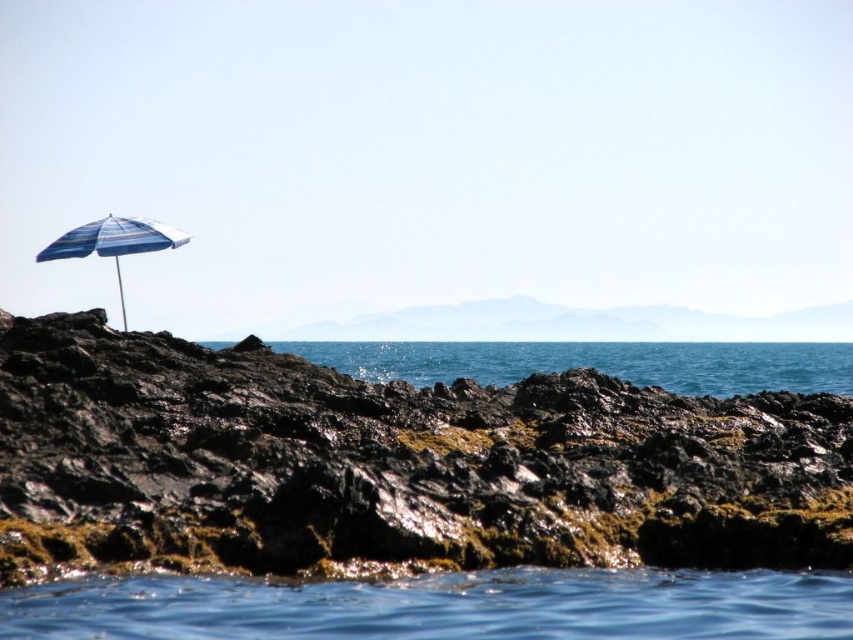
Question: Can you confirm if transparent blue water at lower center is smaller than blue water at center?

Choices:
 (A) no
 (B) yes

Answer: (B)

Question: Where is black rock at left located in relation to transparent blue water at lower center in the image?

Choices:
 (A) right
 (B) left

Answer: (A)

Question: Which of the following is the farthest from the observer?

Choices:
 (A) transparent blue water at lower center
 (B) black rock at left
 (C) striped fabric umbrella at left

Answer: (C)

Question: Which object appears farthest from the camera in this image?

Choices:
 (A) transparent blue water at lower center
 (B) black rock at left

Answer: (B)

Question: Which object is farther from the camera taking this photo?

Choices:
 (A) transparent blue water at lower center
 (B) striped fabric umbrella at left
 (C) black rock at left

Answer: (B)

Question: Can you confirm if black rock at left is wider than transparent blue water at lower center?

Choices:
 (A) no
 (B) yes

Answer: (B)